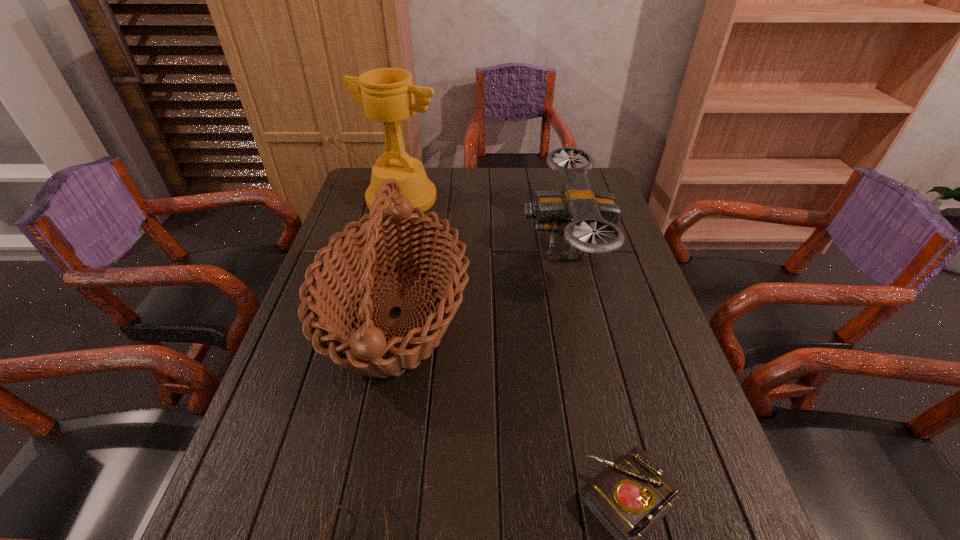
Locate an element on the screen. The height and width of the screenshot is (540, 960). award that is at the left edge is located at coordinates coord(387,94).

Find the location of `basket that is at the left edge`. basket that is at the left edge is located at coordinates (400, 239).

Locate an element on the screen. object situated at the right edge is located at coordinates (582, 215).

Locate an element on the screen. object positioned at the far left corner is located at coordinates (387, 94).

Where is `object located in the far right corner section of the desktop`? object located in the far right corner section of the desktop is located at coordinates (582, 215).

The height and width of the screenshot is (540, 960). Identify the location of vacant space at the far edge. (502, 201).

I want to click on free space at the near edge, so click(x=500, y=536).

Image resolution: width=960 pixels, height=540 pixels. In the image, there is a desktop. Find the location of `vacant space at the right edge`. vacant space at the right edge is located at coordinates 643,430.

The image size is (960, 540). I want to click on vacant space at the far left corner, so click(366, 184).

Image resolution: width=960 pixels, height=540 pixels. What are the coordinates of `free space between the basket and the third shortest object` in the screenshot? It's located at (480, 280).